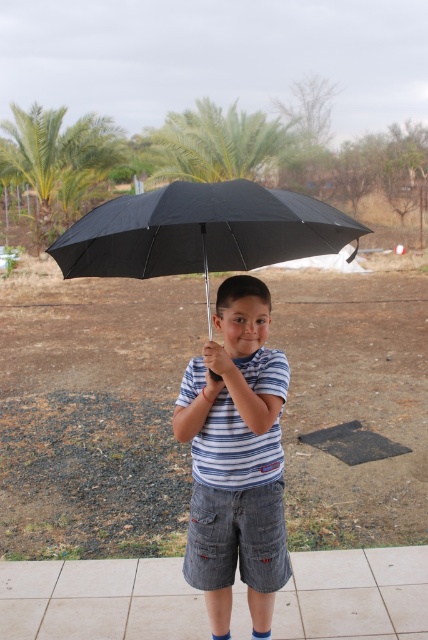
Between black matte umbrella at center and green leafy palm tree at upper left, which one has less height?

green leafy palm tree at upper left

Is black matte umbrella at center positioned in front of green leafy palm tree at upper left?

Yes, black matte umbrella at center is closer to the viewer.

Is point (157, 262) less distant than point (107, 138)?

Yes.

Where is `black matte umbrella at center`? This screenshot has height=640, width=428. black matte umbrella at center is located at coordinates (201, 230).

Is point (196, 534) positioned after point (155, 204)?

Yes, point (196, 534) is farther from viewer.

Who is more distant from viewer, (267, 348) or (231, 234)?

The point (231, 234) is more distant.

This screenshot has width=428, height=640. I want to click on striped cotton shirt at center, so click(x=235, y=458).

In the scene shown: Does striped cotton shirt at center appear under green leafy palm tree at upper center?

Yes, striped cotton shirt at center is below green leafy palm tree at upper center.

Does point (273, 413) come closer to viewer compared to point (228, 154)?

That is True.

You are a GUI agent. You are given a task and a screenshot of the screen. Output one action in this format:
    pyautogui.click(x=<x>, y=<y>)
    Task: Click on the striped cotton shirt at center
    
    Given the screenshot: What is the action you would take?
    pyautogui.click(x=235, y=458)